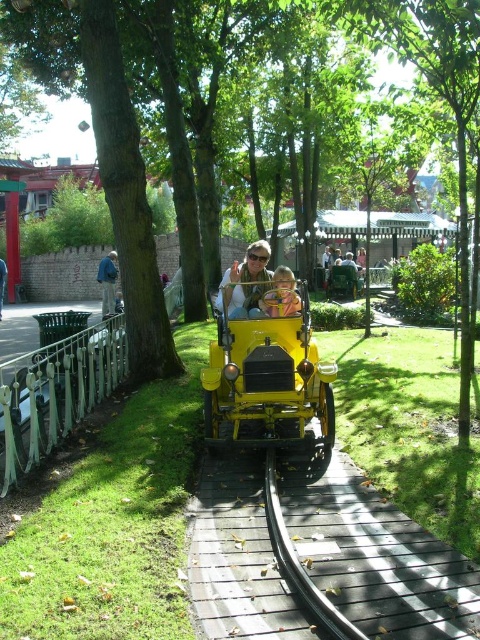
You are standing at the entrance of the theme park and see the wooden at center and the denim jacket at left. Which object is positioned to the right of the other?

The wooden at center is positioned to the right of the denim jacket at left.